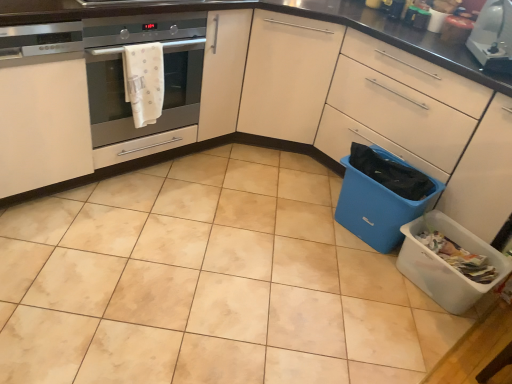
Locate an element on the screen. The image size is (512, 384). space that is in front of blue plastic recycling bin at lower right, marked as the second recycling bin in a bottom-to-top arrangement is located at coordinates (359, 276).